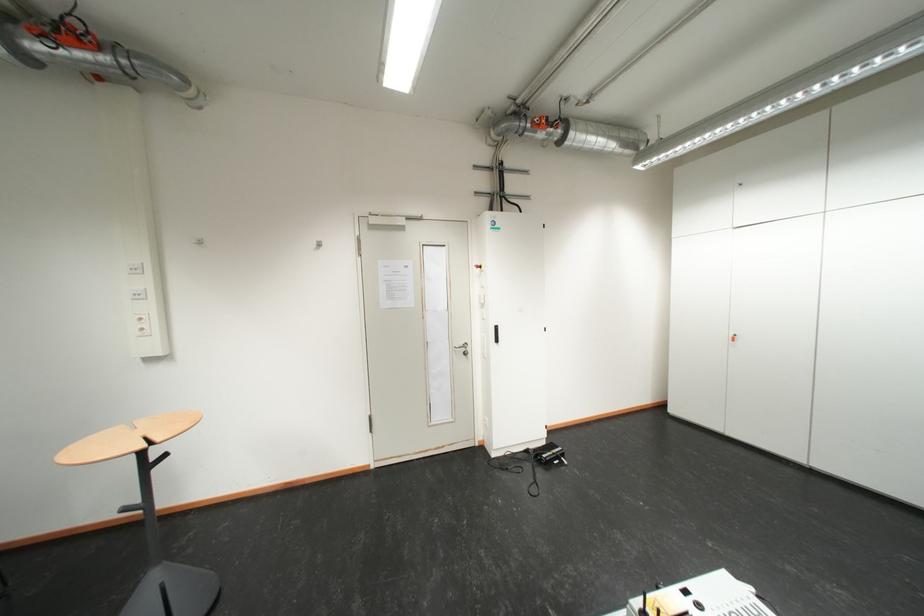
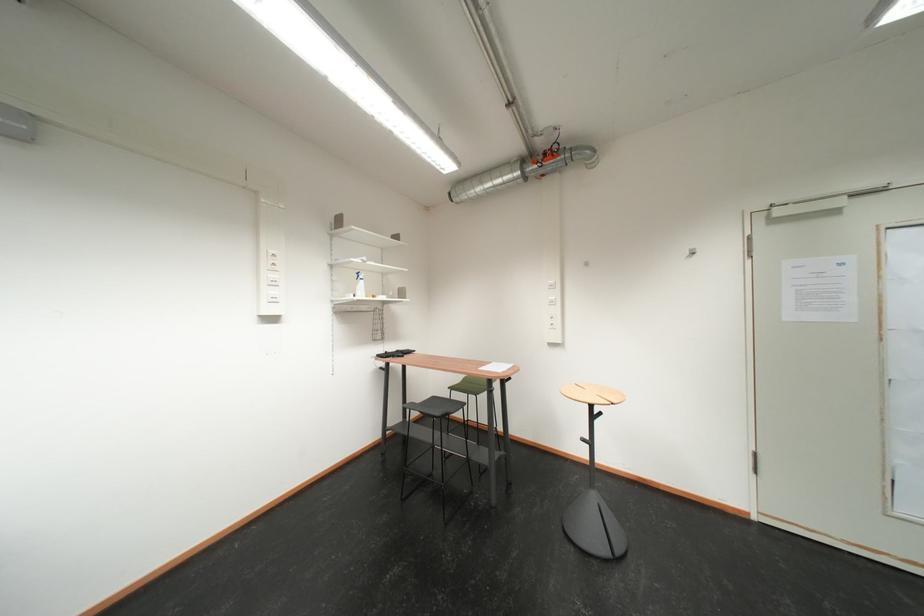
Where in the second image is the point corresponding to (x=59, y=31) from the first image?

(552, 160)